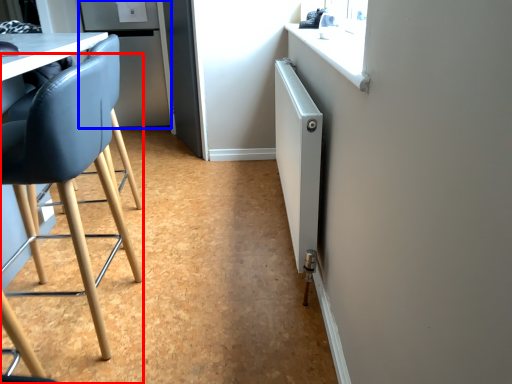
Question: Which of the following is the farthest to the observer, chair (highlighted by a red box) or fridge (highlighted by a blue box)?

Choices:
 (A) chair
 (B) fridge

Answer: (B)